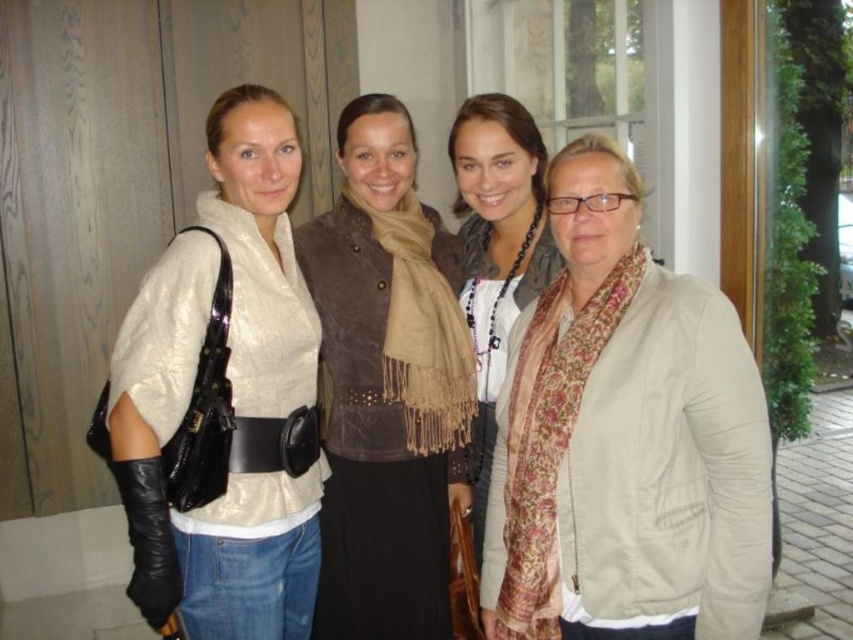
Question: Is matte white blouse at left thinner than floral scarf at center?

Choices:
 (A) yes
 (B) no

Answer: (B)

Question: Which object is positioned closest to the beige fabric jacket at center?

Choices:
 (A) brown suede vest at center
 (B) matte white blouse at left
 (C) floral scarf at center

Answer: (C)

Question: Can you confirm if beige fabric jacket at center is positioned below brown suede vest at center?

Choices:
 (A) yes
 (B) no

Answer: (A)

Question: Which of the following is the farthest from the observer?

Choices:
 (A) matte white blouse at left
 (B) brown suede vest at center
 (C) floral scarf at center

Answer: (C)

Question: Which point appears farthest from the camera in this image?

Choices:
 (A) (265, 400)
 (B) (751, 433)
 (C) (477, 467)
 (D) (456, 324)

Answer: (C)

Question: Is matte white blouse at left to the left of brown suede vest at center from the viewer's perspective?

Choices:
 (A) no
 (B) yes

Answer: (B)